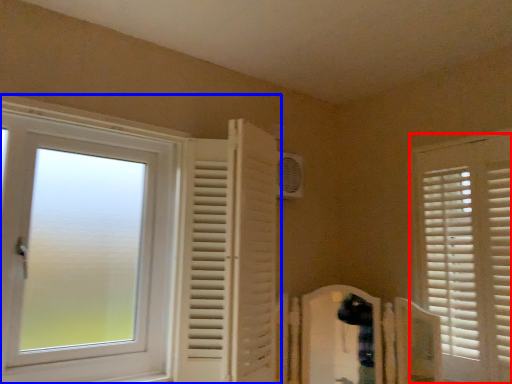
Question: Which of the following is the closest to the observer, window (highlighted by a red box) or window (highlighted by a blue box)?

Choices:
 (A) window
 (B) window

Answer: (B)